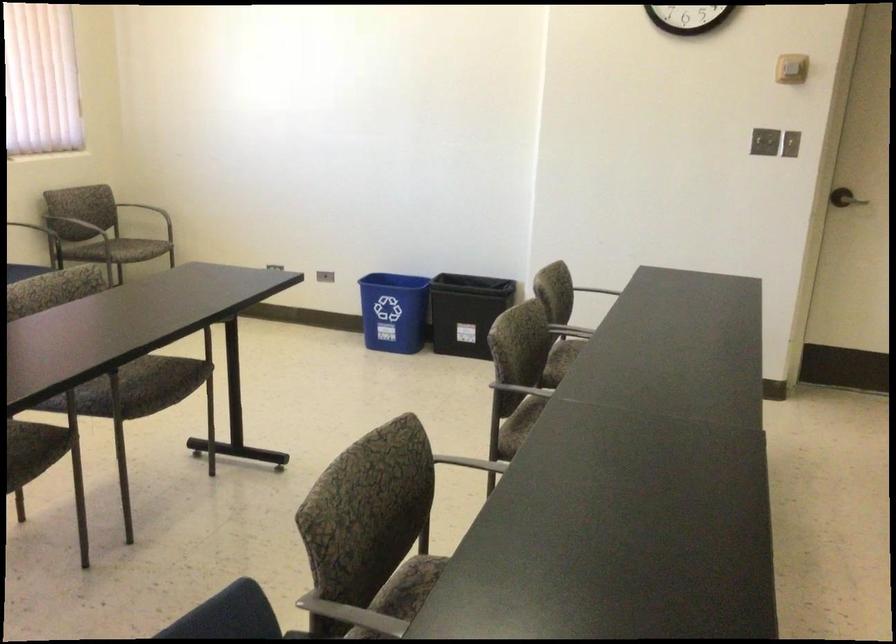
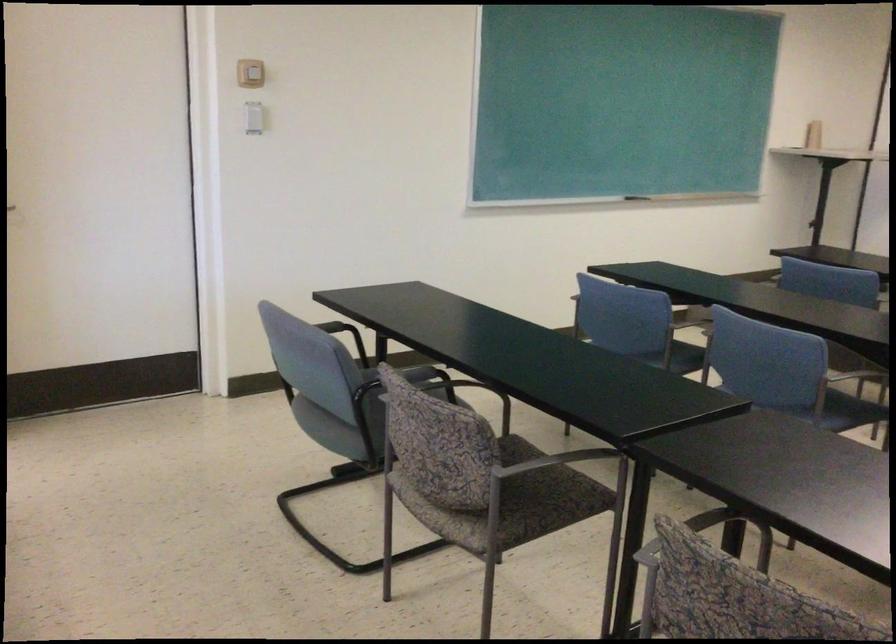
From the picture: First-person continuous shooting, in which direction is the camera rotating?

The camera rotated toward right-down.